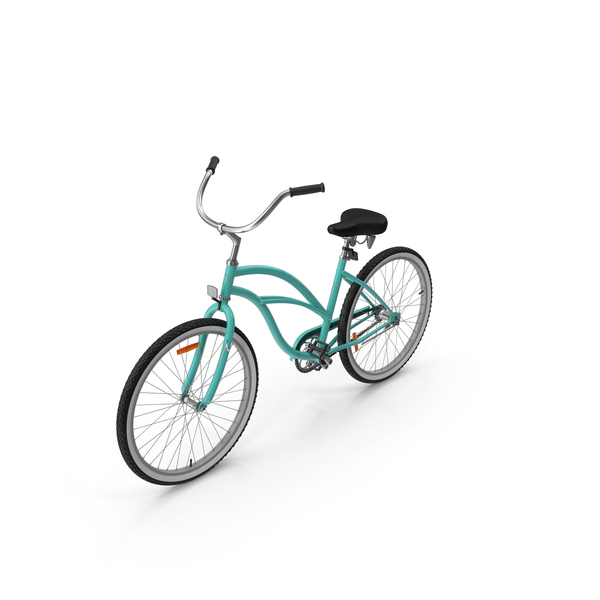
Locate an element on the screen. The height and width of the screenshot is (600, 600). seat is located at coordinates (365, 225).